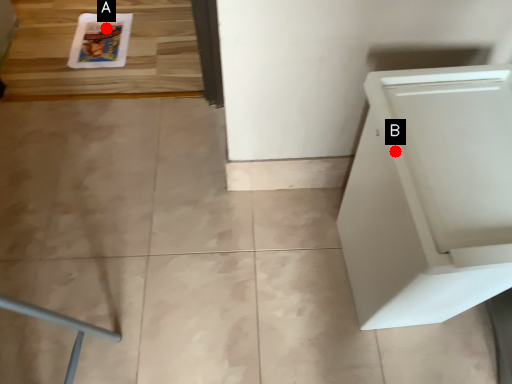
Question: Two points are circled on the image, labeled by A and B beside each circle. Which of the following is the farthest from the observer?

Choices:
 (A) A is further
 (B) B is further

Answer: (A)